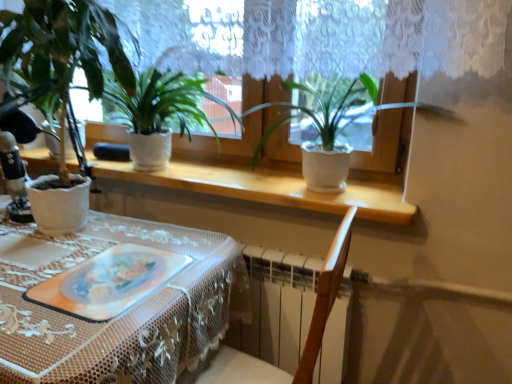
Locate an element on the screen. Image resolution: width=512 pixels, height=384 pixels. vacant space behind translucent plastic platter at center is located at coordinates (131, 238).